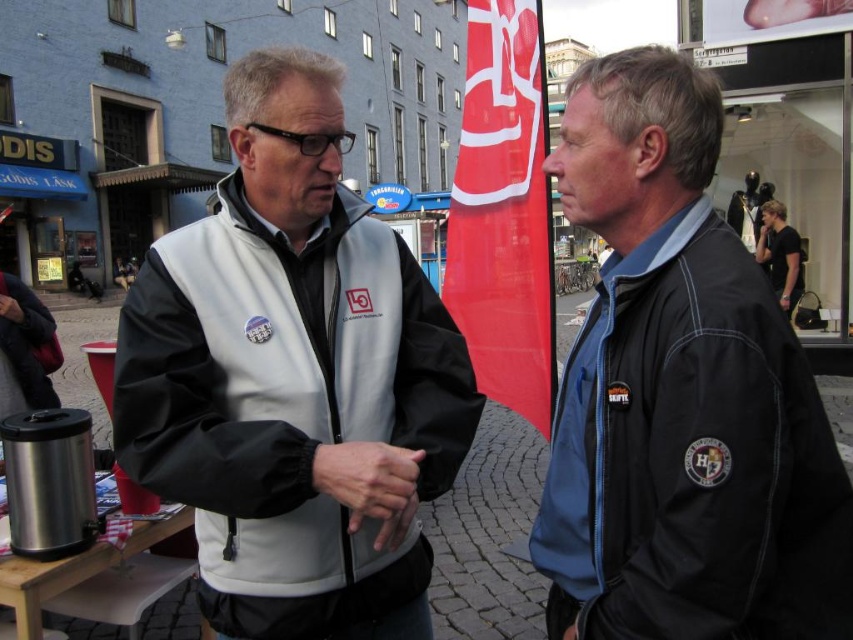
Question: Does white matte jacket at center appear under black matte jacket at center?

Choices:
 (A) no
 (B) yes

Answer: (A)

Question: Is white matte jacket at center to the left of black matte jacket at center from the viewer's perspective?

Choices:
 (A) no
 (B) yes

Answer: (B)

Question: Which point is farther to the camera?

Choices:
 (A) (305, 436)
 (B) (799, 385)

Answer: (A)

Question: Does white matte jacket at center appear over black matte jacket at center?

Choices:
 (A) no
 (B) yes

Answer: (B)

Question: Which point is closer to the camera?

Choices:
 (A) black matte jacket at center
 (B) white matte jacket at center

Answer: (A)